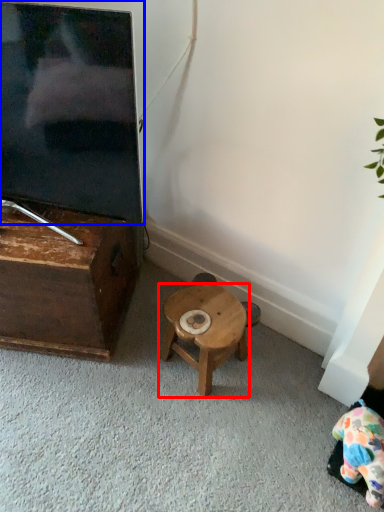
Question: Which object appears farthest to the camera in this image, stool (highlighted by a red box) or television (highlighted by a blue box)?

Choices:
 (A) stool
 (B) television

Answer: (A)